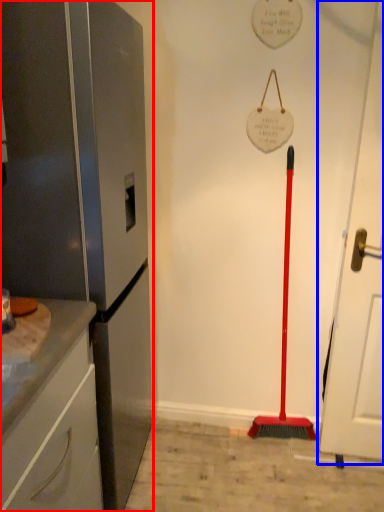
Question: Which of the following is the closest to the observer, appliance (highlighted by a red box) or door (highlighted by a blue box)?

Choices:
 (A) appliance
 (B) door

Answer: (A)